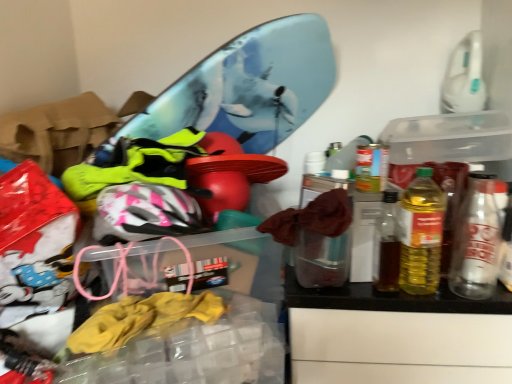
Question: Is yellow translucent bottle at right, which is the second bottle in right-to-left order, shorter than metallic silver can at right, the 1th bottle positioned from the right?

Choices:
 (A) no
 (B) yes

Answer: (A)

Question: Does yellow translucent bottle at right, marked as the 1th bottle in a left-to-right arrangement, appear on the right side of metallic silver can at right, the 1th bottle positioned from the right?

Choices:
 (A) no
 (B) yes

Answer: (A)

Question: Can we say yellow translucent bottle at right, which is the second bottle in right-to-left order, lies outside metallic silver can at right, the 1th bottle positioned from the right?

Choices:
 (A) no
 (B) yes

Answer: (B)

Question: From a real-world perspective, is yellow translucent bottle at right, marked as the 1th bottle in a left-to-right arrangement, beneath metallic silver can at right, the 1th bottle positioned from the right?

Choices:
 (A) yes
 (B) no

Answer: (B)

Question: From the image's perspective, is yellow translucent bottle at right, marked as the 1th bottle in a left-to-right arrangement, over metallic silver can at right, the 1th bottle positioned from the right?

Choices:
 (A) no
 (B) yes

Answer: (B)

Question: Is the depth of yellow translucent bottle at right, marked as the 1th bottle in a left-to-right arrangement, greater than that of metallic silver can at right, the 1th bottle positioned from the right?

Choices:
 (A) yes
 (B) no

Answer: (B)

Question: Can you confirm if metallic silver can at right, which ranks as the second bottle in left-to-right order, is shorter than yellow translucent bottle at right, which is the second bottle in right-to-left order?

Choices:
 (A) no
 (B) yes

Answer: (B)

Question: Does metallic silver can at right, which ranks as the second bottle in left-to-right order, turn towards yellow translucent bottle at right, which is the second bottle in right-to-left order?

Choices:
 (A) no
 (B) yes

Answer: (A)

Question: Does metallic silver can at right, which ranks as the second bottle in left-to-right order, contain yellow translucent bottle at right, marked as the 1th bottle in a left-to-right arrangement?

Choices:
 (A) yes
 (B) no

Answer: (B)

Question: Is metallic silver can at right, which ranks as the second bottle in left-to-right order, to the left of yellow translucent bottle at right, marked as the 1th bottle in a left-to-right arrangement, from the viewer's perspective?

Choices:
 (A) no
 (B) yes

Answer: (A)

Question: From the image's perspective, is metallic silver can at right, which ranks as the second bottle in left-to-right order, above yellow translucent bottle at right, which is the second bottle in right-to-left order?

Choices:
 (A) yes
 (B) no

Answer: (B)

Question: Is metallic silver can at right, the 1th bottle positioned from the right, completely or partially outside of yellow translucent bottle at right, which is the second bottle in right-to-left order?

Choices:
 (A) yes
 (B) no

Answer: (A)

Question: From the image's perspective, is yellow translucent bottle at right, which is the second bottle in right-to-left order, located above or below metallic silver can at right, the 1th bottle positioned from the right?

Choices:
 (A) below
 (B) above

Answer: (B)